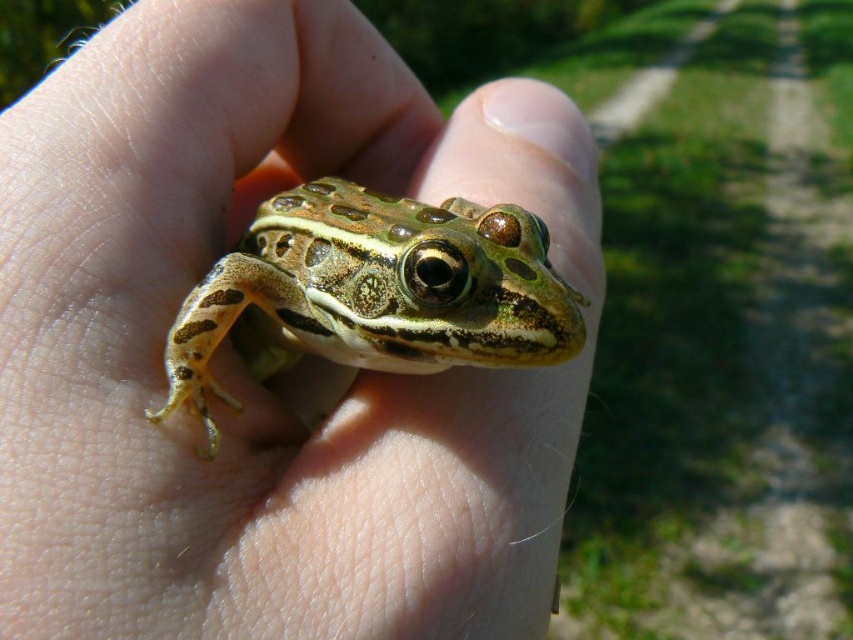
Question: Where is green matte skin at center located in relation to green spotted skin at center in the image?

Choices:
 (A) above
 (B) below

Answer: (B)

Question: In this image, where is green matte skin at center located relative to green spotted skin at center?

Choices:
 (A) right
 (B) left

Answer: (B)

Question: Among these objects, which one is farthest from the camera?

Choices:
 (A) green matte skin at center
 (B) green spotted skin at center

Answer: (B)

Question: Which point is farther to the camera?

Choices:
 (A) (3, 208)
 (B) (503, 298)

Answer: (A)

Question: Can you confirm if green matte skin at center is positioned above green spotted skin at center?

Choices:
 (A) yes
 (B) no

Answer: (B)